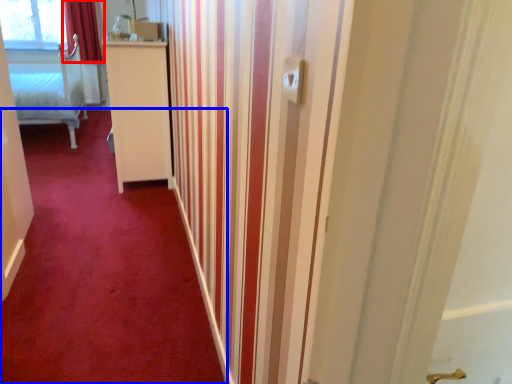
Question: Which point is further to the camera, curtain (highlighted by a red box) or plain (highlighted by a blue box)?

Choices:
 (A) curtain
 (B) plain

Answer: (A)